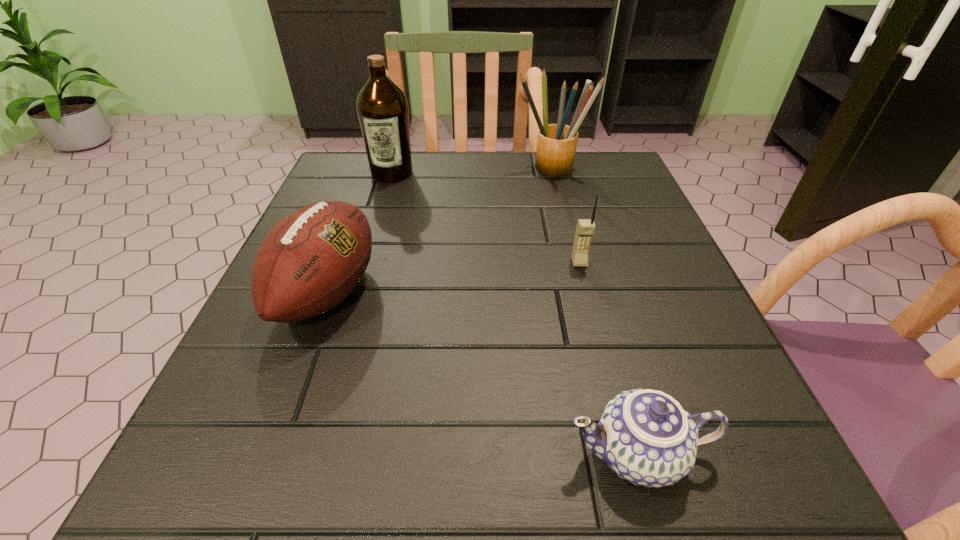
This screenshot has width=960, height=540. I want to click on object situated at the far left corner, so click(382, 108).

Identify the location of object situated at the far right corner. (556, 143).

What are the coordinates of `object present at the near right corner` in the screenshot? It's located at (644, 436).

In the image, there is a desktop. Where is `vacant space at the far edge`? The height and width of the screenshot is (540, 960). vacant space at the far edge is located at coordinates (467, 201).

Locate an element on the screen. vacant position at the near edge of the desktop is located at coordinates (401, 489).

At what (x,y) coordinates should I click in order to perform the action: click on free region at the left edge of the desktop. Please return your answer as a coordinate pair (x, y). The width and height of the screenshot is (960, 540). Looking at the image, I should click on (382, 228).

Where is `free region at the right edge of the desktop`? The width and height of the screenshot is (960, 540). free region at the right edge of the desktop is located at coordinates (635, 321).

Where is `free space at the far left corner of the desktop`? The height and width of the screenshot is (540, 960). free space at the far left corner of the desktop is located at coordinates (344, 200).

Find the location of a particular element. The height and width of the screenshot is (540, 960). vacant area at the near left corner of the desktop is located at coordinates (246, 501).

Locate an element on the screen. The image size is (960, 540). free space at the far right corner of the desktop is located at coordinates click(618, 165).